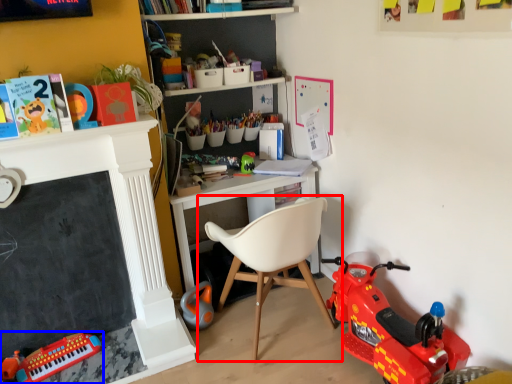
Question: Among these objects, which one is farthest to the camera, chair (highlighted by a red box) or toy (highlighted by a blue box)?

Choices:
 (A) chair
 (B) toy

Answer: (B)